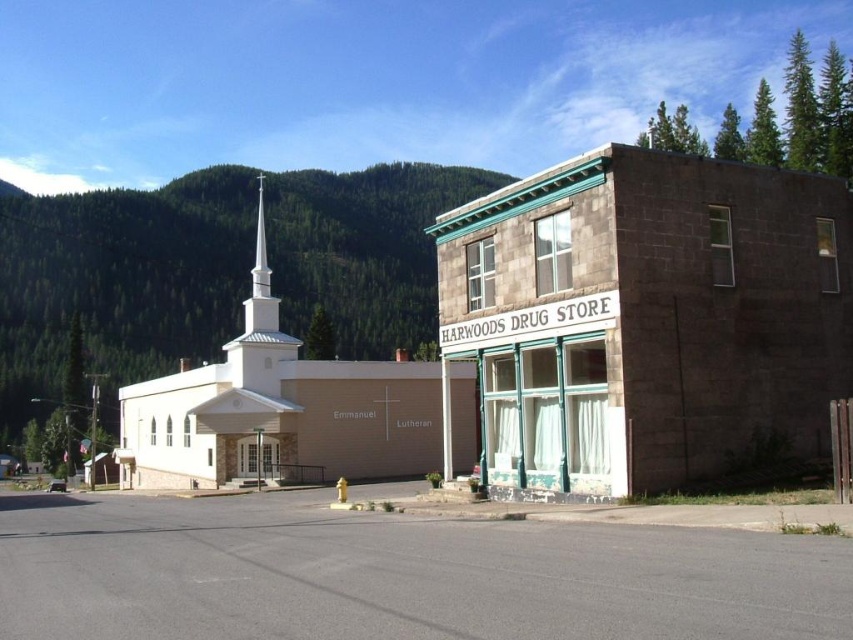
Is matte stone church at center bigger than white smooth steeple at center?

No, matte stone church at center is not bigger than white smooth steeple at center.

Does point (502, 234) lie behind point (256, 220)?

No, (502, 234) is in front of (256, 220).

Locate an element on the screen. matte stone church at center is located at coordinates (646, 317).

Who is shorter, matte stone church at center or white smooth church at center?

matte stone church at center is shorter.

Which is behind, point (846, 218) or point (355, 385)?

Point (355, 385)

Which is in front, point (676, 371) or point (210, 380)?

Point (676, 371) is more forward.

The height and width of the screenshot is (640, 853). What are the coordinates of `matte stone church at center` in the screenshot? It's located at (646, 317).

Can you confirm if white smooth church at center is positioned to the left of white smooth steeple at center?

Indeed, white smooth church at center is positioned on the left side of white smooth steeple at center.

Between white smooth church at center and white smooth steeple at center, which one appears on the right side from the viewer's perspective?

Positioned to the right is white smooth steeple at center.

Does point (369, 435) come farther from viewer compared to point (250, 317)?

No, it is in front of (250, 317).

Where is `white smooth church at center`? This screenshot has height=640, width=853. white smooth church at center is located at coordinates (277, 410).